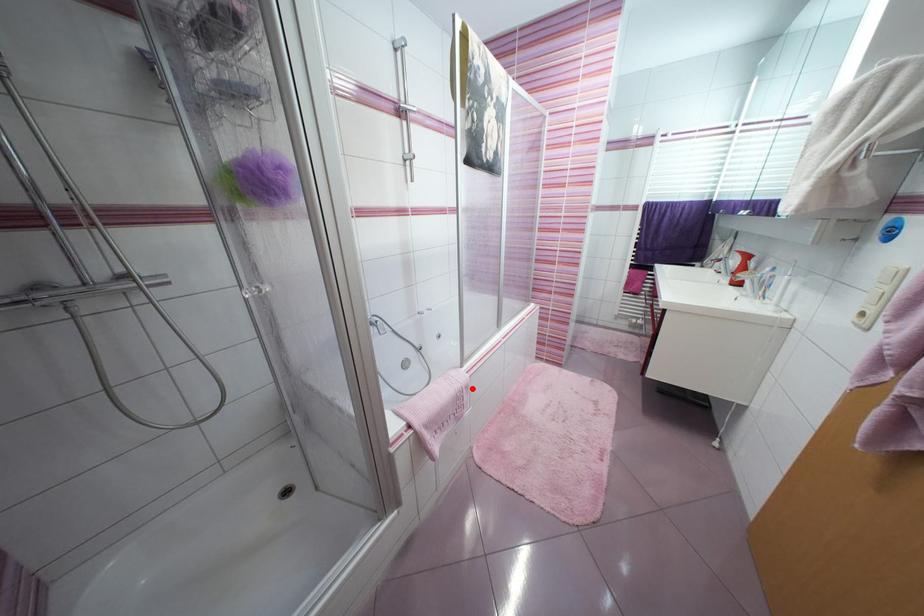
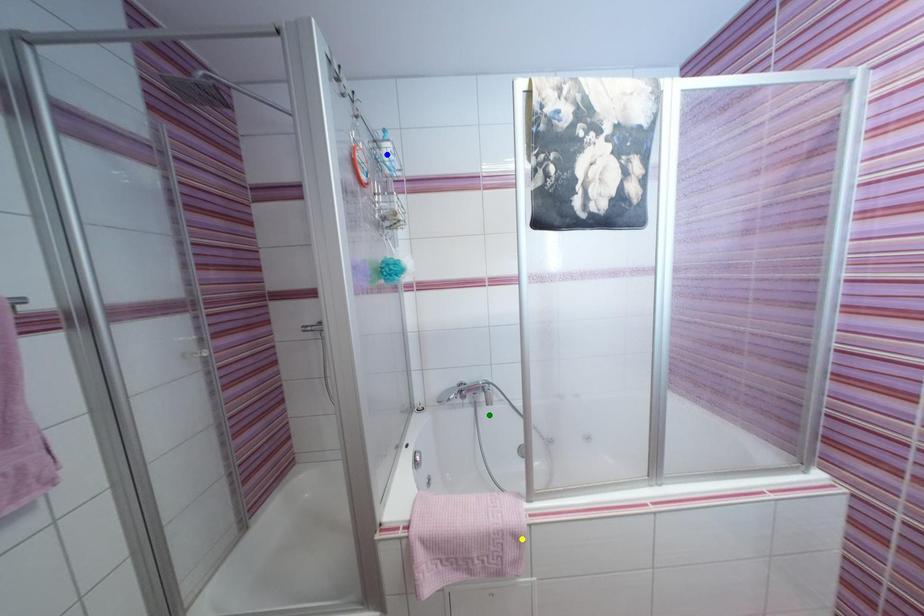
Question: I am providing you with two images of the same scene from different viewpoints. A red point is marked on the first image. You are given multiple points on the second image. Which spot in image 2 lines up with the point in image 1?

Choices:
 (A) green point
 (B) yellow point
 (C) blue point

Answer: (B)